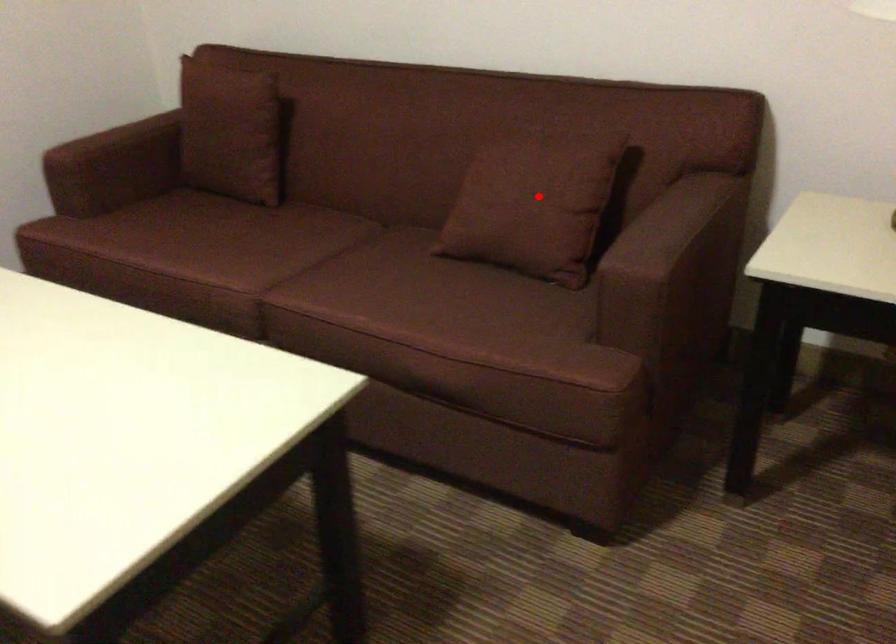
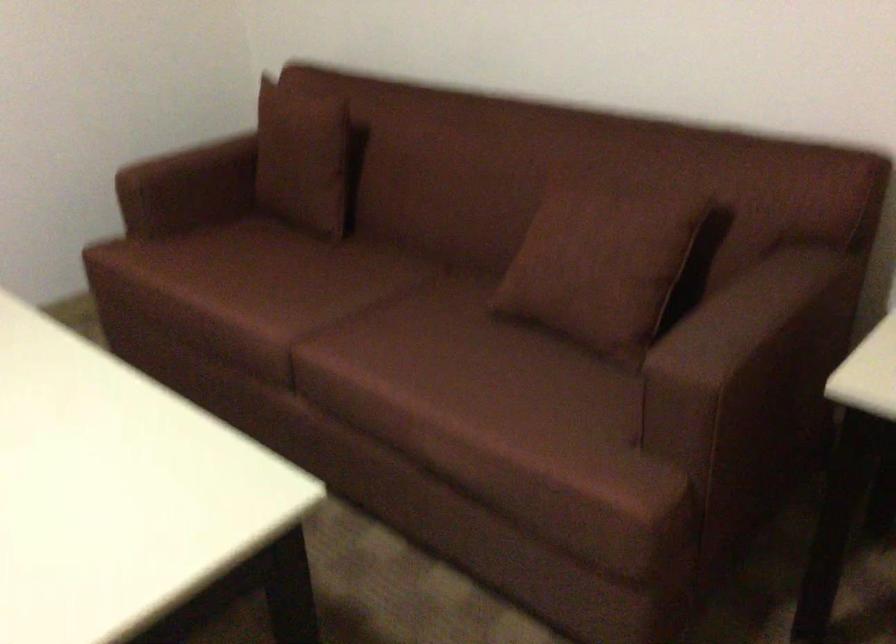
In the second image, find the point that corresponds to the highlighted location in the first image.

(600, 263)